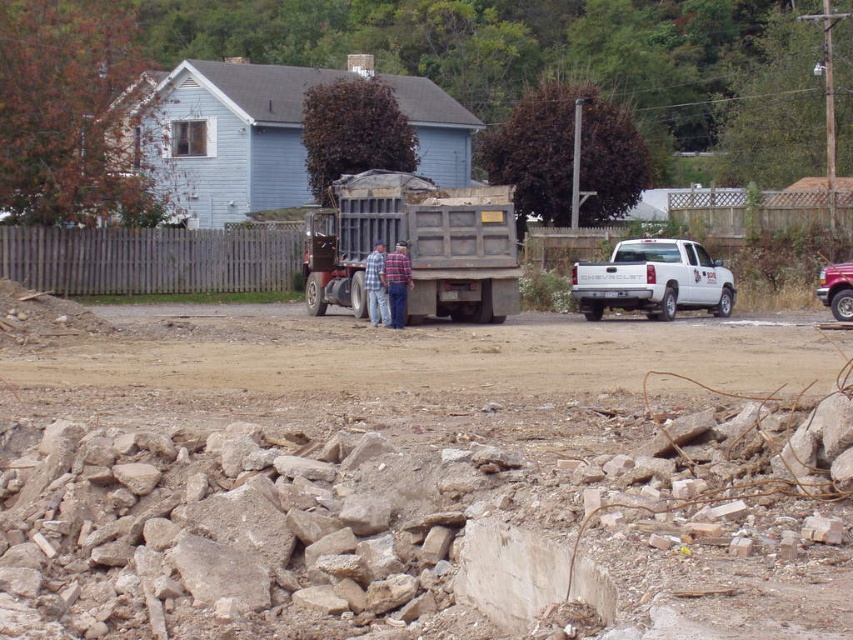
Can you confirm if gray metallic dump truck at center is positioned to the right of blue plaid shirt at center?

In fact, gray metallic dump truck at center is to the left of blue plaid shirt at center.

Which is below, gray metallic dump truck at center or blue plaid shirt at center?

Positioned lower is blue plaid shirt at center.

The image size is (853, 640). In order to click on gray metallic dump truck at center in this screenshot , I will do point(416,244).

You are a GUI agent. You are given a task and a screenshot of the screen. Output one action in this format:
    pyautogui.click(x=<x>, y=<y>)
    Task: Click on the gray metallic dump truck at center
    This screenshot has height=640, width=853.
    Given the screenshot: What is the action you would take?
    pyautogui.click(x=416, y=244)

Is white matte truck at right above blue plaid shirt at center?

Yes, white matte truck at right is above blue plaid shirt at center.

The image size is (853, 640). In order to click on white matte truck at right in this screenshot , I will do `click(653, 280)`.

Identify the location of white matte truck at right. The width and height of the screenshot is (853, 640). (653, 280).

Does brown dirt field at center have a smaller size compared to blue plaid shirt at center?

Incorrect, brown dirt field at center is not smaller in size than blue plaid shirt at center.

Where is `brown dirt field at center`? brown dirt field at center is located at coordinates (424, 356).